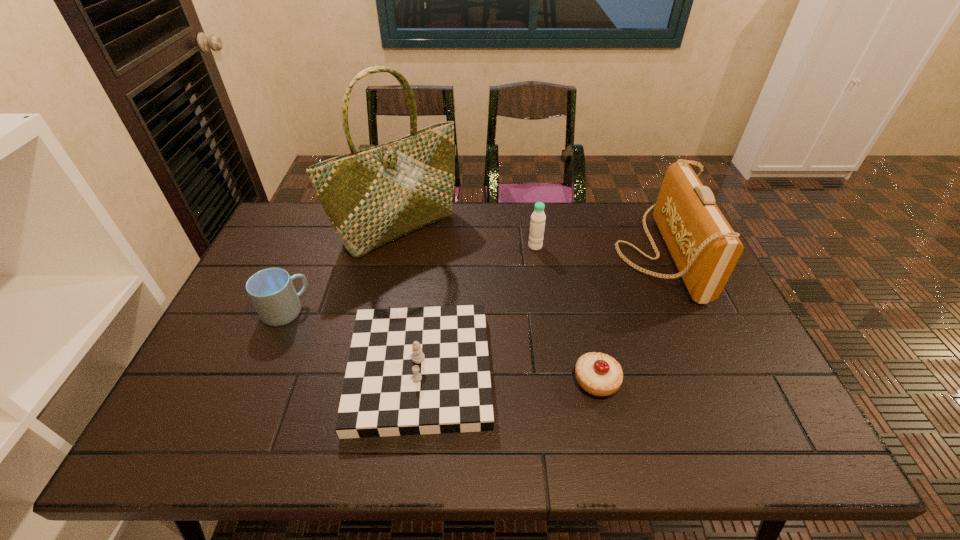
I want to click on object that is at the near edge, so click(425, 370).

This screenshot has width=960, height=540. Find the location of `object present at the left edge`. object present at the left edge is located at coordinates (271, 290).

At what (x,y) coordinates should I click in order to perform the action: click on object at the right edge. Please return your answer as a coordinate pair (x, y). The image size is (960, 540). Looking at the image, I should click on (705, 248).

Where is `object present at the far right corner`? The height and width of the screenshot is (540, 960). object present at the far right corner is located at coordinates (705, 248).

Identify the location of blank area at the far edge. (435, 238).

At what (x,y) coordinates should I click in order to perform the action: click on free location at the near edge. Please return your answer as a coordinate pair (x, y). Image resolution: width=960 pixels, height=540 pixels. Looking at the image, I should click on (578, 455).

Image resolution: width=960 pixels, height=540 pixels. In the image, there is a desktop. Identify the location of vacant space at the left edge. (216, 399).

Image resolution: width=960 pixels, height=540 pixels. In the image, there is a desktop. What are the coordinates of `vacant space at the right edge` in the screenshot? It's located at (677, 272).

In the image, there is a desktop. Identify the location of vacant space at the far right corner. (646, 222).

Identify the location of free space at the near right corner of the desktop. This screenshot has height=540, width=960. pyautogui.click(x=781, y=426).